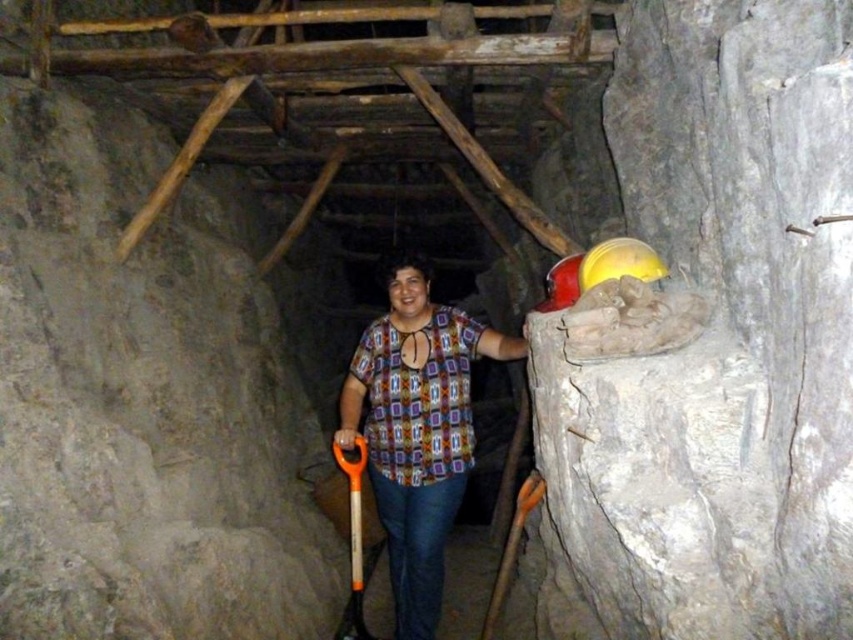
Does printed fabric shirt at center appear over orange plastic shovel at center?

Indeed, printed fabric shirt at center is positioned over orange plastic shovel at center.

Is point (465, 353) positioned in front of point (363, 589)?

Yes, point (465, 353) is in front of point (363, 589).

Does point (410, 339) come behind point (358, 605)?

Yes, point (410, 339) is farther from viewer.

What are the coordinates of `printed fabric shirt at center` in the screenshot? It's located at (416, 428).

In the scene shown: Can you confirm if orange plastic shovel at center is bigger than orange plastic shovel at lower center?

Correct, orange plastic shovel at center is larger in size than orange plastic shovel at lower center.

Who is shorter, orange plastic shovel at center or orange plastic shovel at lower center?

orange plastic shovel at lower center is shorter.

Measure the distance between orange plastic shovel at center and camera.

orange plastic shovel at center and camera are 3.46 meters apart from each other.

Where is `orange plastic shovel at center`? The height and width of the screenshot is (640, 853). orange plastic shovel at center is located at coordinates (354, 538).

Which is more to the left, printed fabric shirt at center or orange plastic shovel at lower center?

From the viewer's perspective, printed fabric shirt at center appears more on the left side.

This screenshot has height=640, width=853. I want to click on printed fabric shirt at center, so click(x=416, y=428).